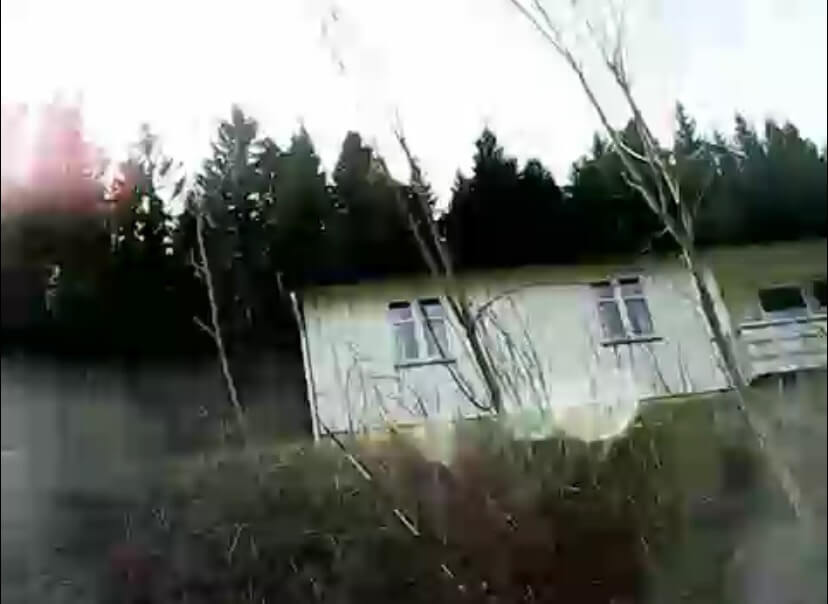
Locate an element on the screen. The image size is (828, 604). window is located at coordinates (429, 329), (639, 315), (778, 299), (820, 291).